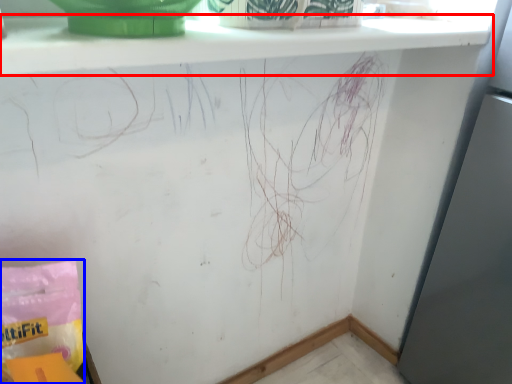
Question: Which object appears closest to the camera in this image, window sill (highlighted by a red box) or material (highlighted by a blue box)?

Choices:
 (A) window sill
 (B) material

Answer: (A)